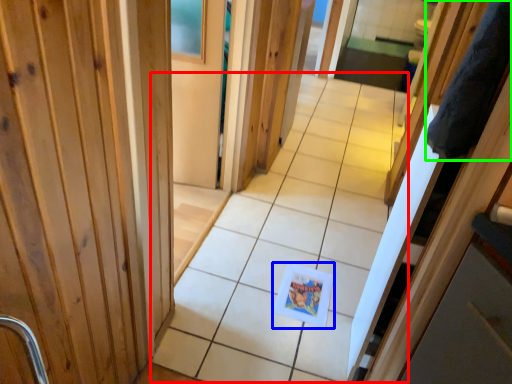
Question: Which object is positioned closest to path (highlighted by a red box)? Select from postcard (highlighted by a blue box) and robe (highlighted by a green box).

Choices:
 (A) postcard
 (B) robe

Answer: (A)